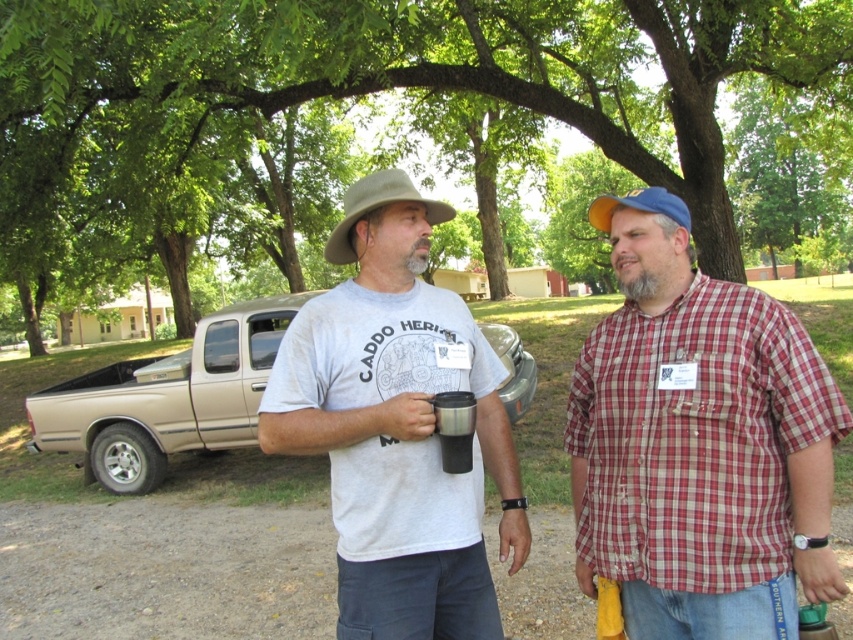
Based on the photo, does green leafy tree at upper center have a greater height compared to silver metallic pickup truck at center?

Yes.

Can you confirm if green leafy tree at upper center is smaller than silver metallic pickup truck at center?

Actually, green leafy tree at upper center might be larger than silver metallic pickup truck at center.

You are a GUI agent. You are given a task and a screenshot of the screen. Output one action in this format:
    pyautogui.click(x=<x>, y=<y>)
    Task: Click on the green leafy tree at upper center
    The height and width of the screenshot is (640, 853).
    Given the screenshot: What is the action you would take?
    pyautogui.click(x=399, y=76)

You are a GUI agent. You are given a task and a screenshot of the screen. Output one action in this format:
    pyautogui.click(x=<x>, y=<y>)
    Task: Click on the green leafy tree at upper center
    The width and height of the screenshot is (853, 640).
    Given the screenshot: What is the action you would take?
    pyautogui.click(x=399, y=76)

Between plaid cotton shirt at center and white matte t-shirt at center, which one appears on the right side from the viewer's perspective?

From the viewer's perspective, plaid cotton shirt at center appears more on the right side.

Does point (639, 403) come farther from viewer compared to point (451, 609)?

No, (639, 403) is closer to viewer.

At what (x,y) coordinates should I click in order to perform the action: click on plaid cotton shirt at center. Please return your answer as a coordinate pair (x, y). The height and width of the screenshot is (640, 853). Looking at the image, I should click on (699, 442).

Is white matte t-shirt at center further to the viewer compared to matte gray t-shirt at center?

No.

Can you confirm if white matte t-shirt at center is positioned to the right of matte gray t-shirt at center?

Yes, white matte t-shirt at center is to the right of matte gray t-shirt at center.

Locate an element on the screen. This screenshot has width=853, height=640. white matte t-shirt at center is located at coordinates (398, 440).